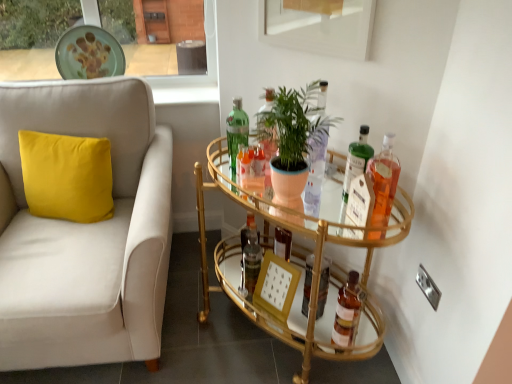
Question: From a real-world perspective, is green matte plant at center physically located above or below gold glass bar cart at center?

Choices:
 (A) below
 (B) above

Answer: (B)

Question: Is green matte plant at center in front of or behind gold glass bar cart at center in the image?

Choices:
 (A) behind
 (B) front

Answer: (A)

Question: Based on their relative distances, which object is farther from the translucent glass bottle at center, the fourth bottle in the right-to-left sequence?

Choices:
 (A) gold glass bar cart at center
 (B) wooden picture frame at center
 (C) brown glass bottle at lower right, placed as the 2th bottle when sorted from right to left
 (D) green matte plate at upper center
 (E) green glass bottle at center, positioned as the fifth bottle in right-to-left order

Answer: (D)

Question: Estimate the real-world distances between objects in this image. Which object is closer to the translucent glass bottle at center, the second bottle positioned from the left?

Choices:
 (A) wooden picture frame at center
 (B) green matte plant at center
 (C) gold glass bar cart at center
 (D) green matte plate at upper center
 (E) brown glass bottle at lower right, placed as the 2th bottle when sorted from right to left

Answer: (A)